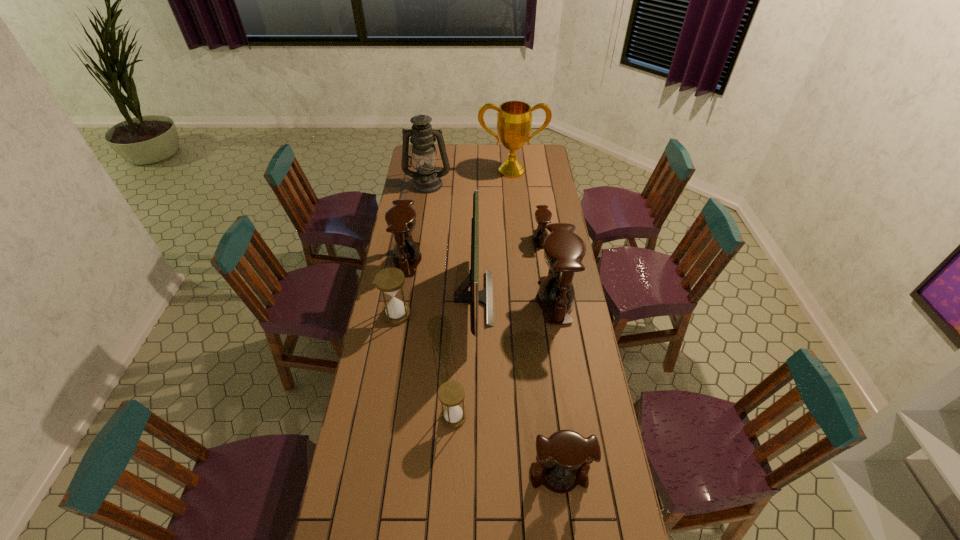
Find the location of a particular element. Image resolution: width=960 pixels, height=540 pixels. free space between the fifth shortest hourglass and the oil lamp is located at coordinates (418, 222).

Where is `unoccupied area between the nearest hourglass and the third smallest brown hourglass`? unoccupied area between the nearest hourglass and the third smallest brown hourglass is located at coordinates (483, 368).

The image size is (960, 540). In order to click on unoccupied area between the second tallest hourglass and the monitor in this screenshot , I will do `click(441, 279)`.

Where is `empty space between the second tallest hourglass and the monitor`? empty space between the second tallest hourglass and the monitor is located at coordinates (441, 279).

This screenshot has height=540, width=960. I want to click on the closest object to the monitor, so click(x=401, y=218).

Select which object is the seventh closest to the monitor. Please provide its 2D coordinates. Your answer should be formatted as a tuple, i.e. [(x, y)], where the tuple contains the x and y coordinates of a point satisfying the conditions above.

[(426, 179)]

Identify the location of the fifth closest hourglass to the oil lamp. The width and height of the screenshot is (960, 540). (451, 393).

The width and height of the screenshot is (960, 540). Find the location of `hourglass that can be found as the fourth closest to the sixth shortest object`. hourglass that can be found as the fourth closest to the sixth shortest object is located at coordinates (389, 280).

Locate which brown hourglass ranks fourth in proximity to the monitor. Please provide its 2D coordinates. Your answer should be formatted as a tuple, i.e. [(x, y)], where the tuple contains the x and y coordinates of a point satisfying the conditions above.

[(569, 455)]

Locate an element on the screen. This screenshot has width=960, height=540. brown hourglass that is the third closest to the gold award is located at coordinates (564, 250).